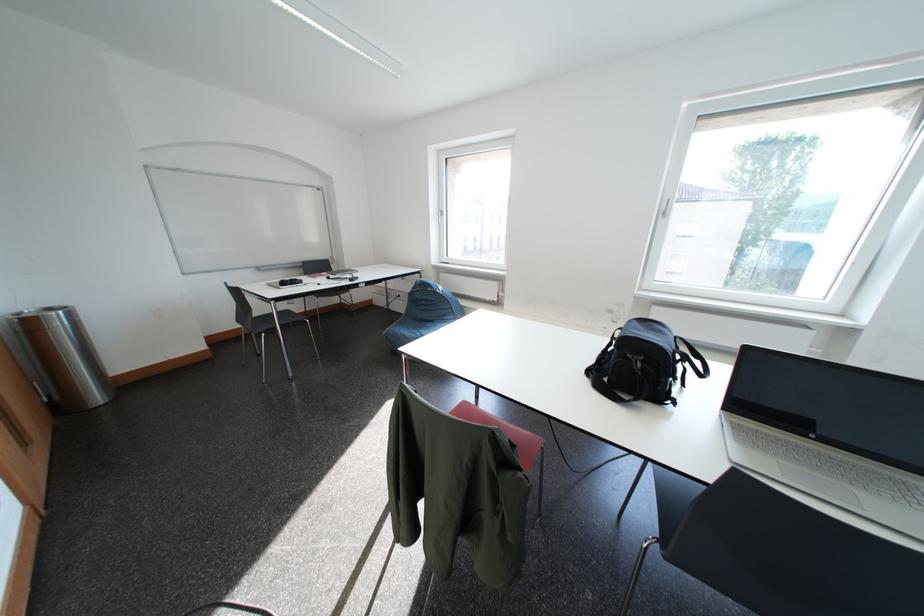
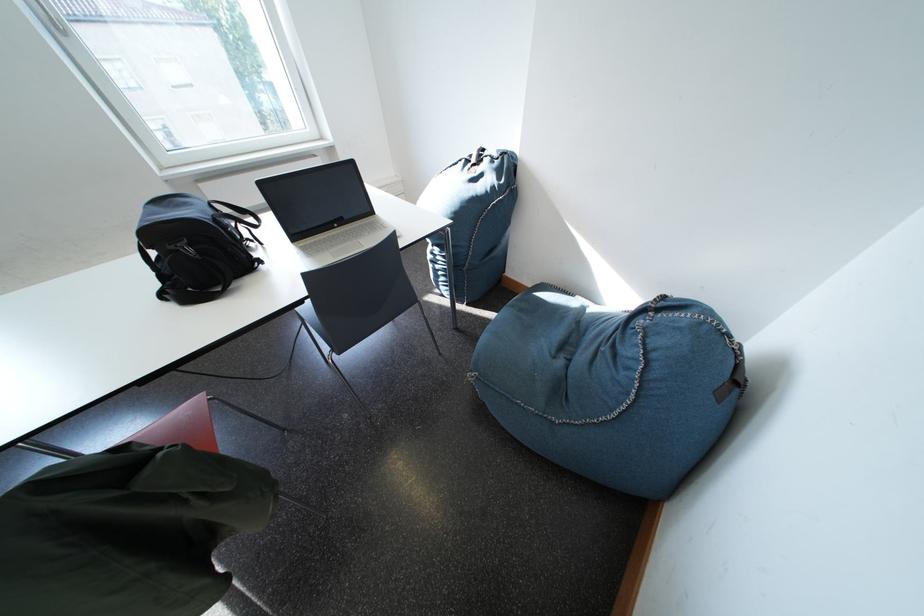
The point at (x=682, y=349) is marked in the first image. Where is the corresponding point in the second image?

(214, 216)